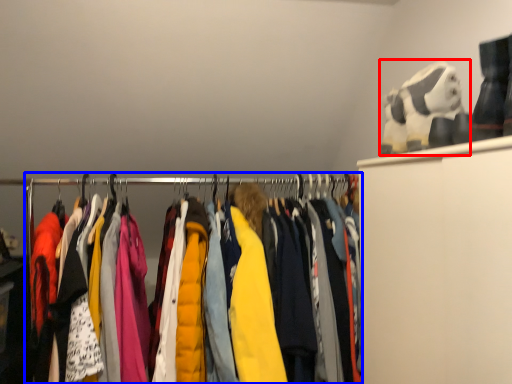
Question: Which object is further to the camera taking this photo, toy (highlighted by a red box) or closet (highlighted by a blue box)?

Choices:
 (A) toy
 (B) closet

Answer: (A)